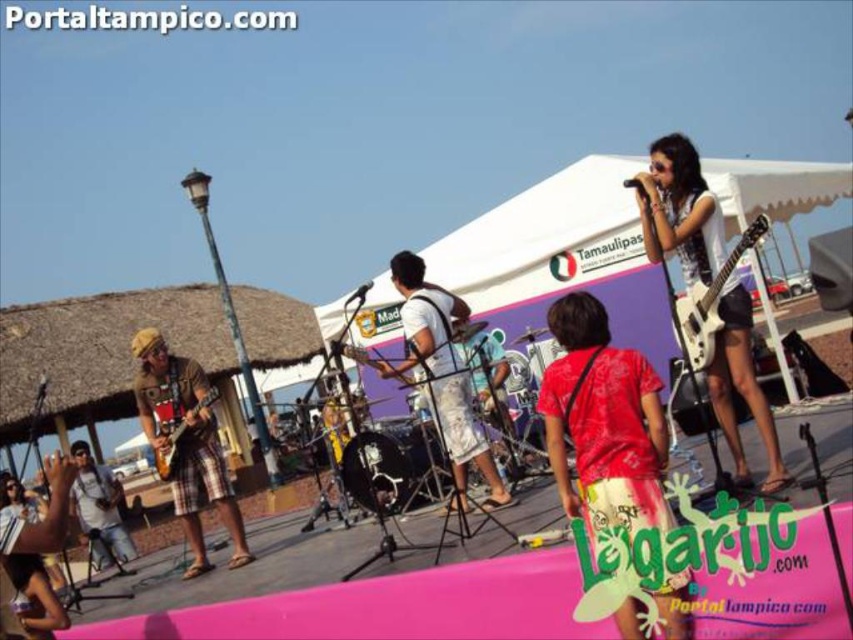
Can you confirm if red cotton shirt at center is smaller than matte brown guitar at lower left?

Indeed, red cotton shirt at center has a smaller size compared to matte brown guitar at lower left.

Which is behind, point (584, 380) or point (9, 634)?

Positioned behind is point (9, 634).

You are a GUI agent. You are given a task and a screenshot of the screen. Output one action in this format:
    pyautogui.click(x=<x>, y=<y>)
    Task: Click on the red cotton shirt at center
    
    Given the screenshot: What is the action you would take?
    pyautogui.click(x=602, y=420)

Which is behind, point (635, 176) or point (711, 360)?

Point (635, 176)

Who is positioned more to the left, white glossy guitar at center or white glossy electric guitar at upper right?

From the viewer's perspective, white glossy electric guitar at upper right appears more on the left side.

This screenshot has height=640, width=853. Find the location of `white glossy guitar at center`. white glossy guitar at center is located at coordinates (679, 209).

The image size is (853, 640). I want to click on red cotton shirt at center, so click(x=602, y=420).

Is point (612, 454) closer to viewer compared to point (383, 376)?

Yes, it is.

This screenshot has height=640, width=853. I want to click on red cotton shirt at center, so click(x=602, y=420).